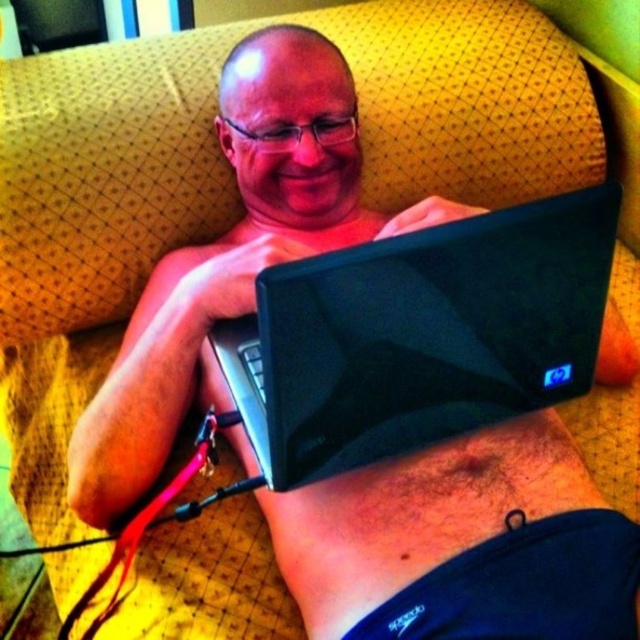
Question: Which object is farther from the camera taking this photo?

Choices:
 (A) hairy skin at center
 (B) black glossy laptop at center

Answer: (A)

Question: Can you confirm if black glossy laptop at center is positioned below hairy skin at center?

Choices:
 (A) no
 (B) yes

Answer: (A)

Question: Does black glossy laptop at center have a larger size compared to hairy skin at center?

Choices:
 (A) no
 (B) yes

Answer: (B)

Question: Which object appears closest to the camera in this image?

Choices:
 (A) hairy skin at center
 (B) black glossy laptop at center

Answer: (B)

Question: Which point is farther from the camera taking this photo?

Choices:
 (A) (440, 426)
 (B) (465, 502)

Answer: (B)

Question: Does black glossy laptop at center come in front of hairy skin at center?

Choices:
 (A) no
 (B) yes

Answer: (B)